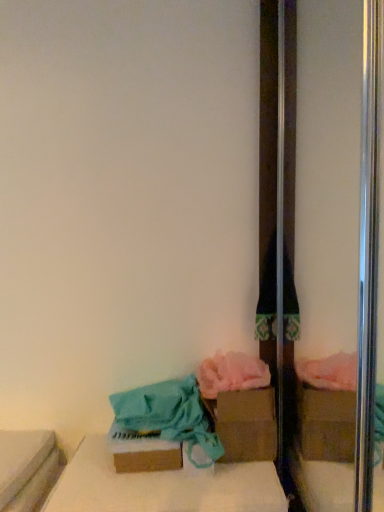
You are a GUI agent. You are given a task and a screenshot of the screen. Output one action in this format:
    pyautogui.click(x=<x>, y=<y>)
    Task: Click on the free space on the front side of brown cardboard box at lower center, which is the 1th cardboard box from left to right
    This screenshot has height=512, width=384.
    Given the screenshot: What is the action you would take?
    pyautogui.click(x=126, y=496)